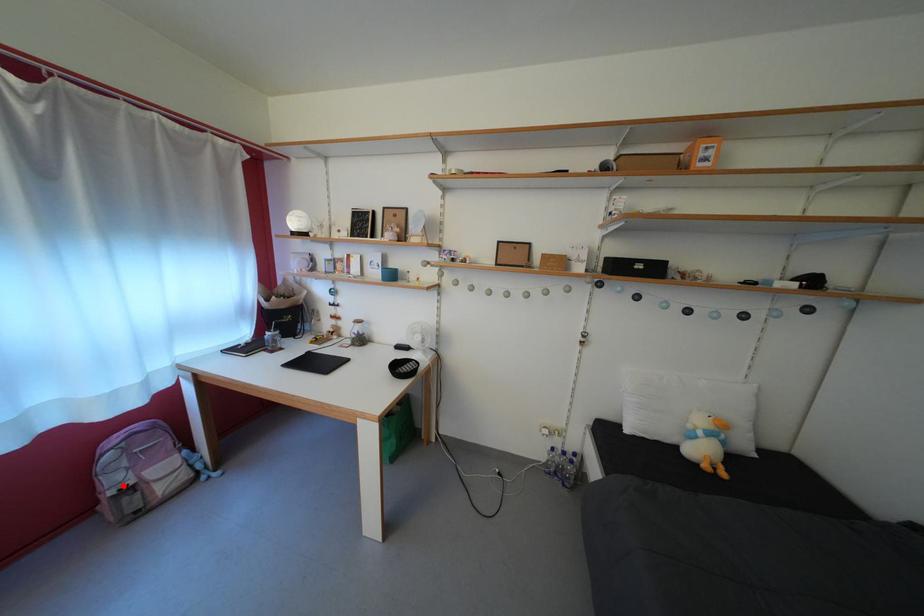
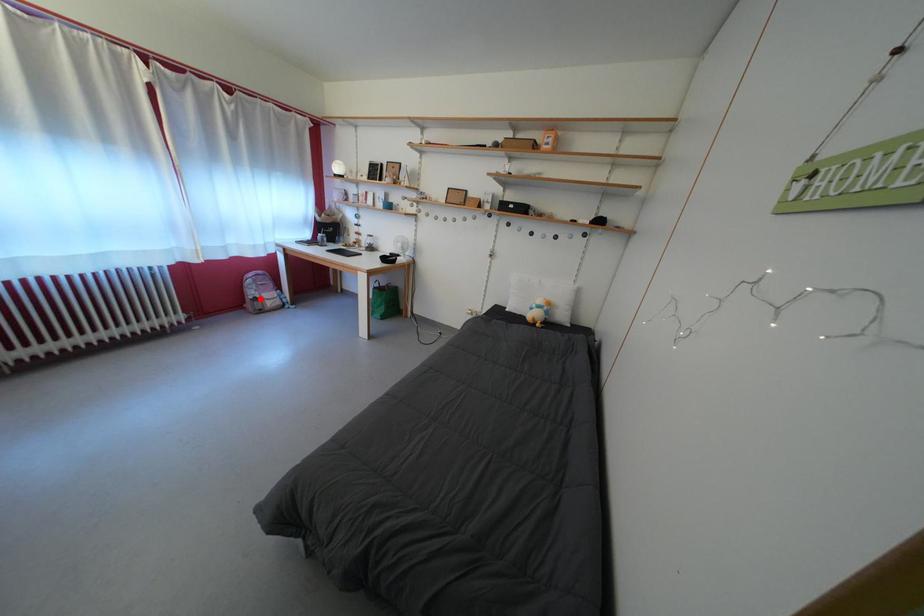
I am providing you with two images of the same scene from different viewpoints. A red point is marked on the first image and another point is marked on the second image. Does the point marked in image1 correspond to the same location as the one in image2?

Yes